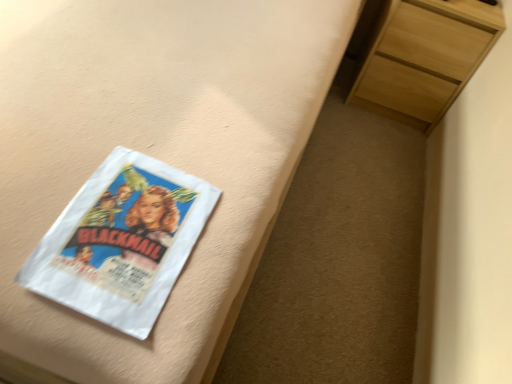
Identify the location of matte white bed frame at upper left. click(155, 152).

At what (x,y) coordinates should I click in order to perform the action: click on light wood chest of drawers at upper right. Please return your answer as a coordinate pair (x, y). Looking at the image, I should click on (424, 57).

Who is shorter, light wood chest of drawers at upper right or white paper at left?

white paper at left is shorter.

From the image's perspective, is light wood chest of drawers at upper right positioned above or below white paper at left?

Clearly, from the image's perspective, light wood chest of drawers at upper right is above white paper at left.

Considering the positions of objects light wood chest of drawers at upper right and white paper at left in the image provided, who is more to the right, light wood chest of drawers at upper right or white paper at left?

Positioned to the right is light wood chest of drawers at upper right.

How many degrees apart are the facing directions of light wood chest of drawers at upper right and white paper at left?

They differ by 0.238 degrees in their facing directions.

Based on their positions, is matte white bed frame at upper left located to the left or right of light wood chest of drawers at upper right?

From the image, it's evident that matte white bed frame at upper left is to the left of light wood chest of drawers at upper right.

Would you say matte white bed frame at upper left contains light wood chest of drawers at upper right?

No, light wood chest of drawers at upper right is not a part of matte white bed frame at upper left.

Does matte white bed frame at upper left have a larger size compared to light wood chest of drawers at upper right?

Indeed, matte white bed frame at upper left has a larger size compared to light wood chest of drawers at upper right.

Is matte white bed frame at upper left taller or shorter than white paper at left?

matte white bed frame at upper left is taller than white paper at left.

Is matte white bed frame at upper left at the left side of white paper at left?

Correct, you'll find matte white bed frame at upper left to the left of white paper at left.

Is matte white bed frame at upper left oriented towards white paper at left?

Yes, matte white bed frame at upper left is facing white paper at left.

Considering the relative sizes of white paper at left and matte white bed frame at upper left in the image provided, is white paper at left bigger than matte white bed frame at upper left?

Incorrect, white paper at left is not larger than matte white bed frame at upper left.

Based on the photo, from the image's perspective, is white paper at left located above or below matte white bed frame at upper left?

Clearly, from the image's perspective, white paper at left is below matte white bed frame at upper left.

Relative to matte white bed frame at upper left, is white paper at left in front or behind?

Clearly, white paper at left is behind matte white bed frame at upper left.

Is light wood chest of drawers at upper right oriented towards matte white bed frame at upper left?

No, light wood chest of drawers at upper right is not turned towards matte white bed frame at upper left.

Does light wood chest of drawers at upper right have a greater width compared to matte white bed frame at upper left?

In fact, light wood chest of drawers at upper right might be narrower than matte white bed frame at upper left.

Between light wood chest of drawers at upper right and matte white bed frame at upper left, which one has more height?

matte white bed frame at upper left.

What are the coordinates of `chest of drawers below the white paper at left (from a real-world perspective)` in the screenshot? It's located at (424, 57).

From a real-world perspective, is white paper at left above or below light wood chest of drawers at upper right?

white paper at left is situated higher than light wood chest of drawers at upper right in the real world.

In the image, is white paper at left on the left side or the right side of light wood chest of drawers at upper right?

Based on their positions, white paper at left is located to the left of light wood chest of drawers at upper right.

Between white paper at left and light wood chest of drawers at upper right, which one has larger size?

With larger size is light wood chest of drawers at upper right.

Locate an element on the screen. This screenshot has width=512, height=384. chest of drawers to the right of white paper at left is located at coordinates (424, 57).

You are a GUI agent. You are given a task and a screenshot of the screen. Output one action in this format:
    pyautogui.click(x=<x>, y=<y>)
    Task: Click on the bed frame above the light wood chest of drawers at upper right (from a real-world perspective)
    
    Given the screenshot: What is the action you would take?
    pyautogui.click(x=155, y=152)

From the picture: Considering their positions, is matte white bed frame at upper left positioned further to white paper at left than light wood chest of drawers at upper right?

Among the two, light wood chest of drawers at upper right is located further to white paper at left.

Estimate the real-world distances between objects in this image. Which object is further from white paper at left, light wood chest of drawers at upper right or matte white bed frame at upper left?

light wood chest of drawers at upper right.

Based on their spatial positions, is white paper at left or matte white bed frame at upper left further from light wood chest of drawers at upper right?

white paper at left.

From the image, which object appears to be nearer to matte white bed frame at upper left, white paper at left or light wood chest of drawers at upper right?

white paper at left lies closer to matte white bed frame at upper left than the other object.

Based on the photo, looking at the image, which one is located closer to matte white bed frame at upper left, light wood chest of drawers at upper right or white paper at left?

white paper at left.

Looking at the image, which one is located closer to light wood chest of drawers at upper right, matte white bed frame at upper left or white paper at left?

matte white bed frame at upper left lies closer to light wood chest of drawers at upper right than the other object.

The height and width of the screenshot is (384, 512). In order to click on paperback book positioned between matte white bed frame at upper left and light wood chest of drawers at upper right from near to far in this screenshot , I will do tap(122, 241).